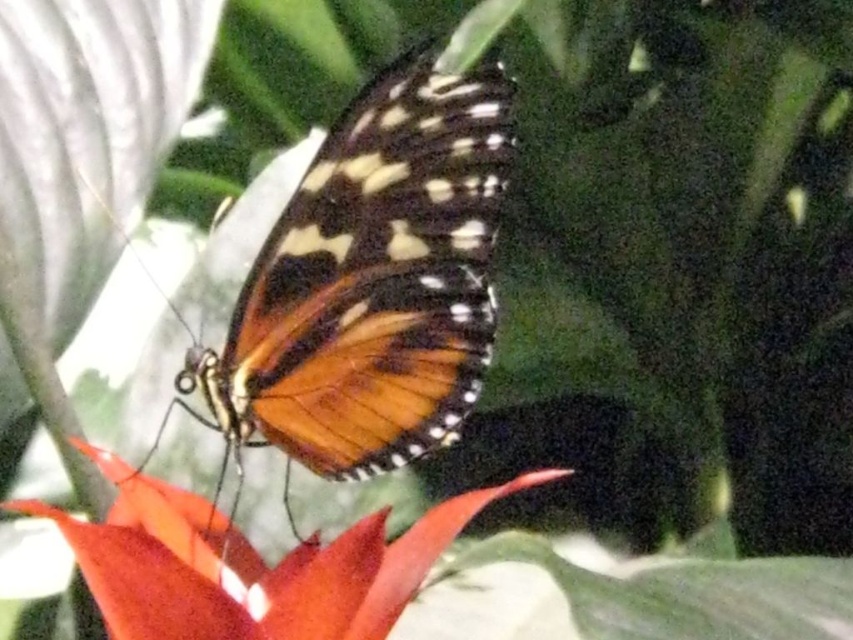
Is orange iridescent wings at center thinner than orange matte flower at center?

Yes.

Between orange iridescent wings at center and orange matte flower at center, which one is positioned higher?

Positioned higher is orange iridescent wings at center.

Identify the location of orange iridescent wings at center. This screenshot has width=853, height=640. (369, 284).